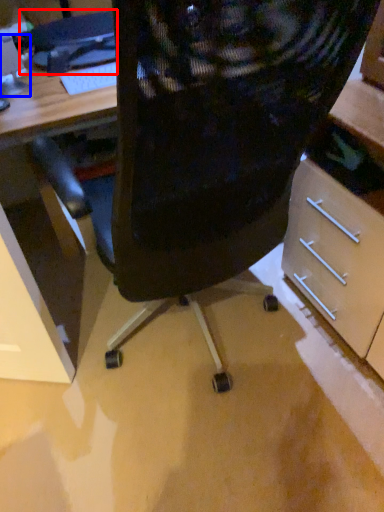
Question: Which point is closer to the camera, computer (highlighted by a red box) or computer monitor (highlighted by a blue box)?

Choices:
 (A) computer
 (B) computer monitor

Answer: (B)